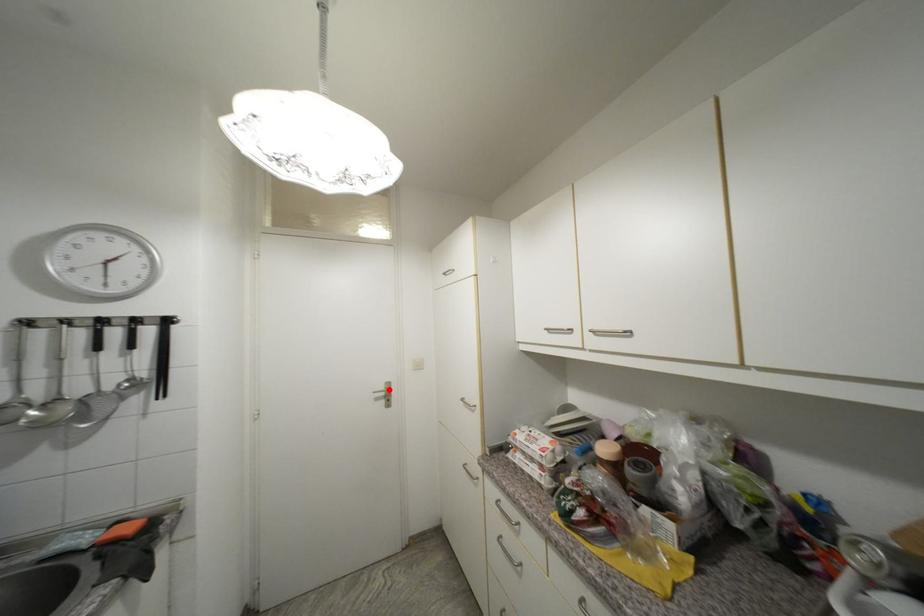
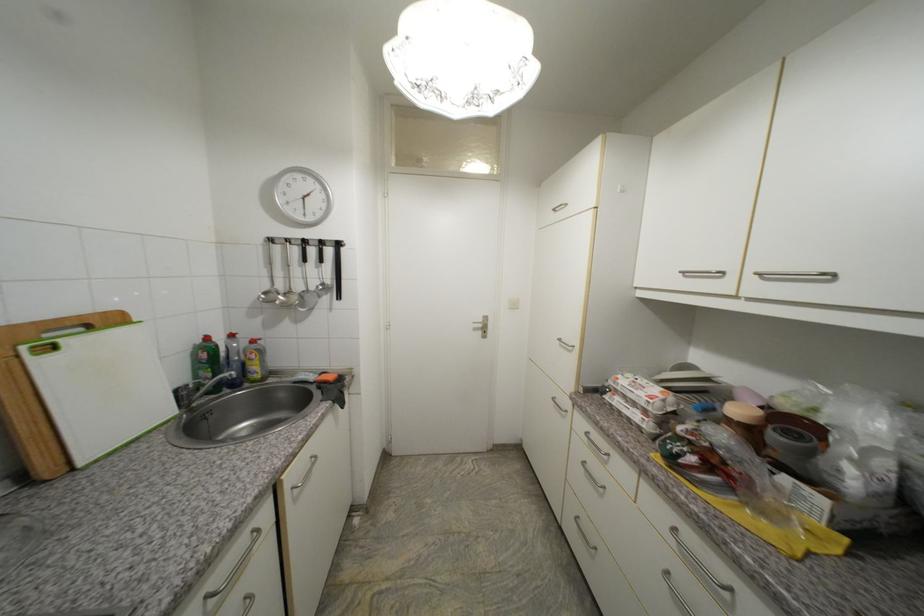
Find the pixel in the second image that matches the highlighted location in the first image.

(487, 322)